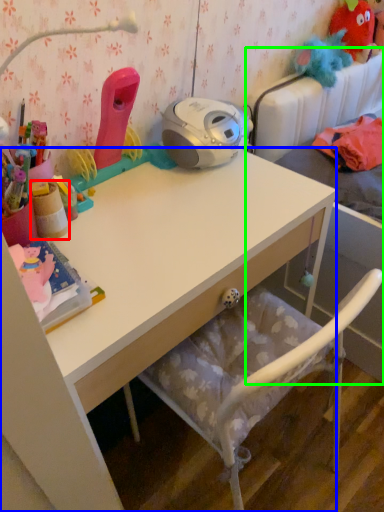
Question: Estimate the real-world distances between objects in this image. Which object is closer to stationery (highlighted by a red box), desk (highlighted by a blue box) or bed (highlighted by a green box)?

Choices:
 (A) desk
 (B) bed

Answer: (A)